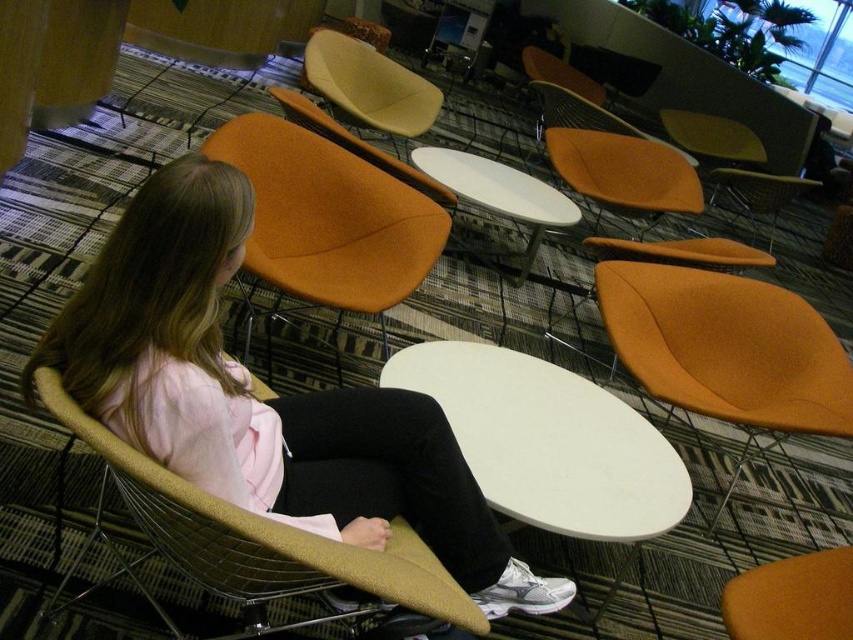
You are standing in the lounge and want to sit down. Which chair is closer to you, the matte orange chair at center or the orange fabric armchair at left?

The matte orange chair at center is closer to the viewer than the orange fabric armchair at left, so the matte orange chair at center is closer to you.

You are standing at the entrance of the lounge and want to sit down. You see the matte orange chair at center and the beige leather armchair at upper center. Which chair is closer to you?

The matte orange chair at center is closer to you because it is positioned in front of the beige leather armchair at upper center.